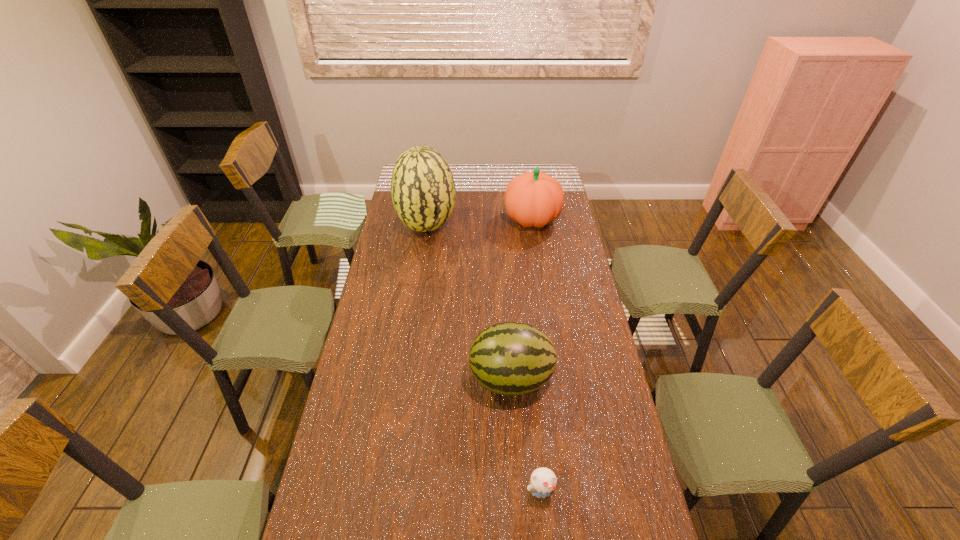
At what (x,y) coordinates should I click in order to perform the action: click on free space located 0.320m at the stem end of the second shortest object. Please return your answer as a coordinate pair (x, y). Image resolution: width=960 pixels, height=540 pixels. Looking at the image, I should click on (374, 379).

The image size is (960, 540). Find the location of `vacant point located at the stem end of the second shortest object`. vacant point located at the stem end of the second shortest object is located at coordinates (354, 379).

The image size is (960, 540). I want to click on object positioned at the left edge, so click(423, 191).

The height and width of the screenshot is (540, 960). I want to click on object at the right edge, so click(x=533, y=199).

In order to click on blank area at the far edge in this screenshot , I will do `click(467, 178)`.

In order to click on vacant space at the left edge in this screenshot , I will do (x=348, y=448).

The height and width of the screenshot is (540, 960). In the image, there is a desktop. In order to click on vacant region at the right edge in this screenshot , I will do `click(564, 297)`.

Locate an element on the screen. The image size is (960, 540). free space between the shortest object and the shorter watermelon is located at coordinates (526, 436).

I want to click on unoccupied position between the second tallest object and the nearer watermelon, so click(x=521, y=299).

Identify the location of free space between the leftmost object and the right watermelon. This screenshot has width=960, height=540. (469, 302).